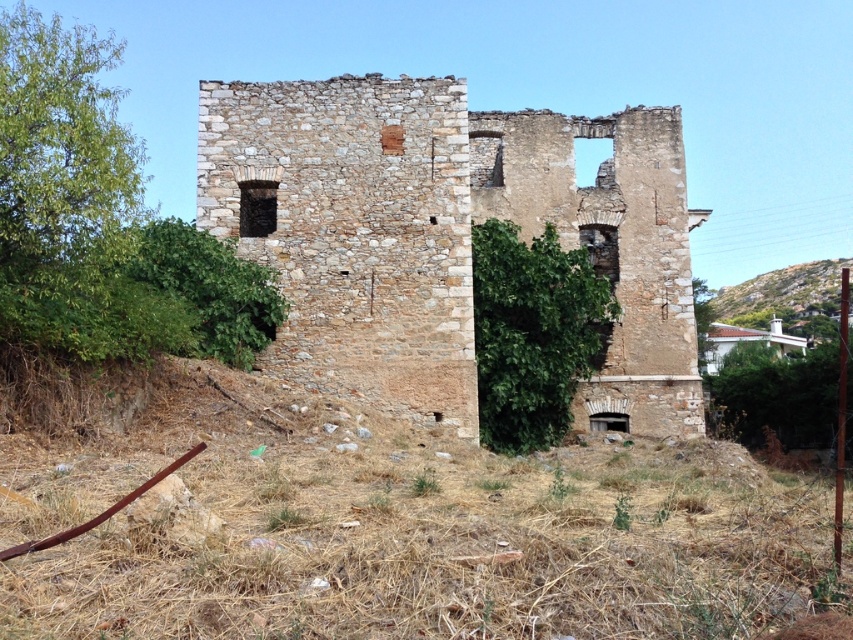
Question: Is rustic stone ruins at center to the right of green grassy hillside at right from the viewer's perspective?

Choices:
 (A) yes
 (B) no

Answer: (B)

Question: Based on their relative distances, which object is nearer to the green leafy bush at center?

Choices:
 (A) rustic stone ruins at center
 (B) green grassy hillside at right

Answer: (A)

Question: Which point is farther to the camera?

Choices:
 (A) (759, 276)
 (B) (566, 333)
 (C) (229, 145)

Answer: (A)

Question: Which point appears closest to the camera in this image?

Choices:
 (A) (486, 385)
 (B) (769, 289)
 (C) (549, 136)

Answer: (A)

Question: Is rustic stone ruins at center to the left of green grassy hillside at right from the viewer's perspective?

Choices:
 (A) no
 (B) yes

Answer: (B)

Question: Does rustic stone ruins at center appear under green leafy bush at center?

Choices:
 (A) yes
 (B) no

Answer: (B)